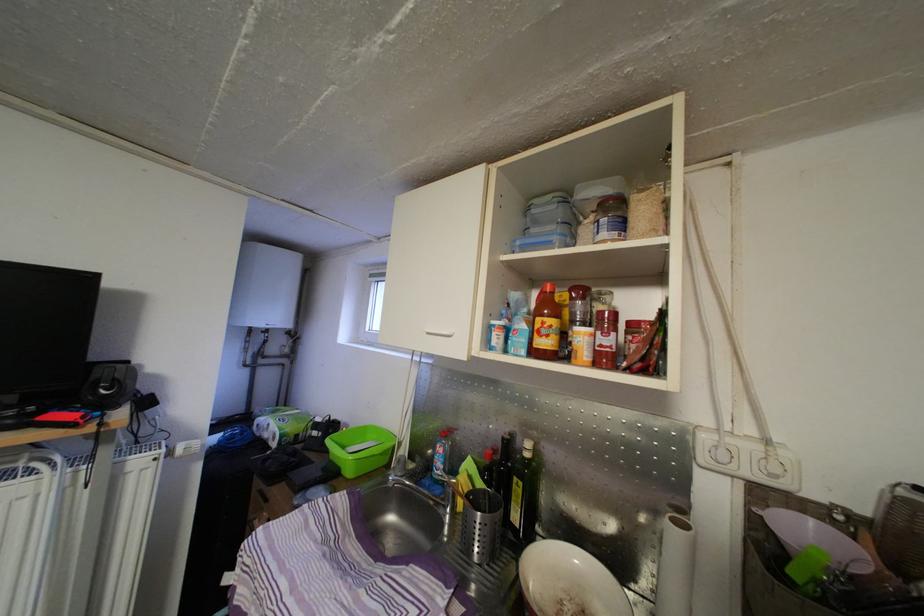
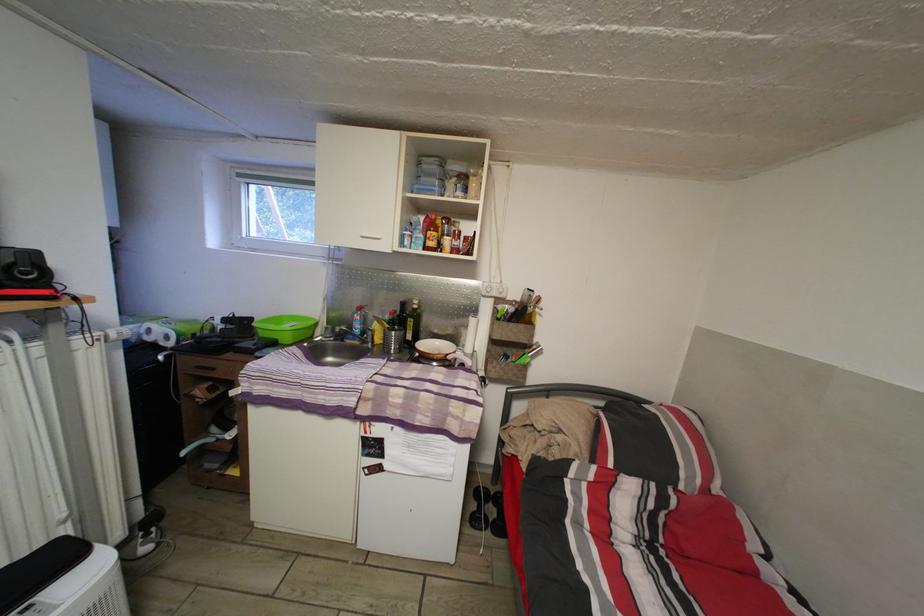
The point at (434, 339) is marked in the first image. Where is the corresponding point in the second image?

(370, 244)